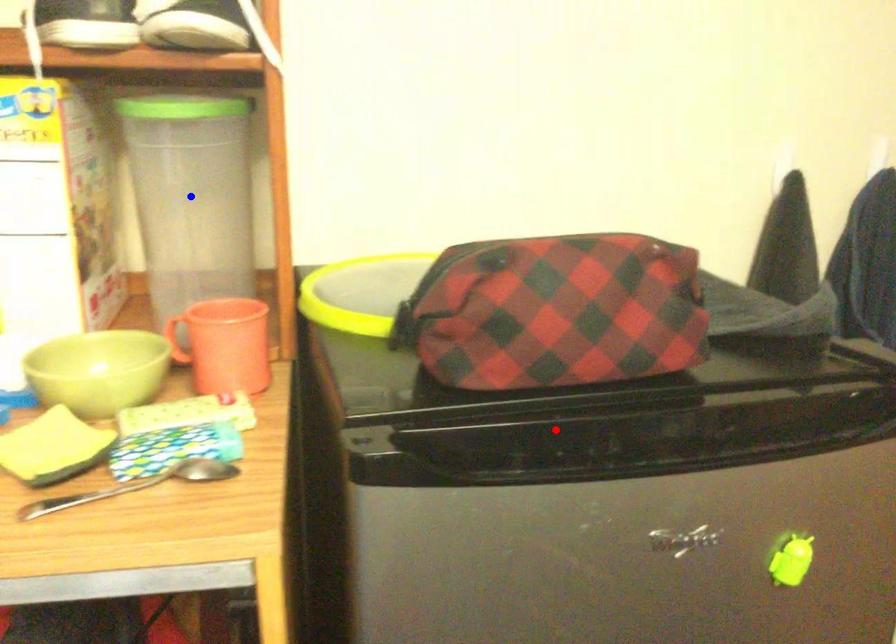
Question: In the image, two points are highlighted. Which point is nearer to the camera? Reply with the corresponding letter.

Choices:
 (A) blue point
 (B) red point

Answer: (B)